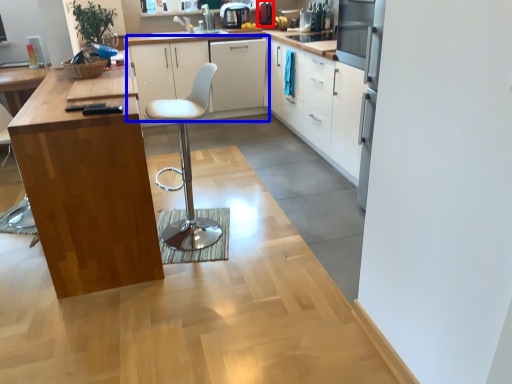
Question: Which object is closer to the camera taking this photo, appliance (highlighted by a red box) or cabinetry (highlighted by a blue box)?

Choices:
 (A) appliance
 (B) cabinetry

Answer: (B)